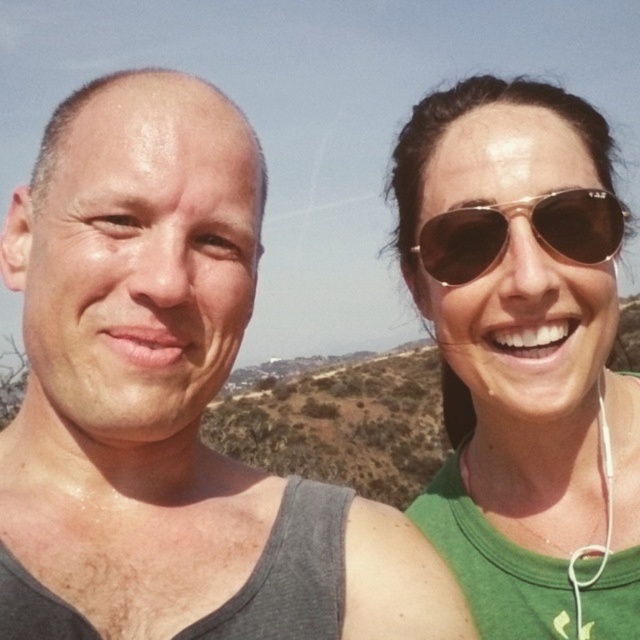
Question: Can you confirm if matte gold sunglasses at upper right is positioned to the right of brown reflective sunglasses at upper right?

Choices:
 (A) yes
 (B) no

Answer: (A)

Question: Which object appears farthest from the camera in this image?

Choices:
 (A) matte gold sunglasses at upper right
 (B) gray tank top at left
 (C) brown reflective sunglasses at upper right

Answer: (A)

Question: From the image, what is the correct spatial relationship of matte gold sunglasses at upper right in relation to brown reflective sunglasses at upper right?

Choices:
 (A) above
 (B) below

Answer: (A)

Question: Which object appears closest to the camera in this image?

Choices:
 (A) brown reflective sunglasses at upper right
 (B) gray tank top at left

Answer: (B)

Question: Considering the real-world distances, which object is farthest from the brown reflective sunglasses at upper right?

Choices:
 (A) gray tank top at left
 (B) matte gold sunglasses at upper right

Answer: (A)

Question: Does matte gold sunglasses at upper right have a greater width compared to brown reflective sunglasses at upper right?

Choices:
 (A) yes
 (B) no

Answer: (A)